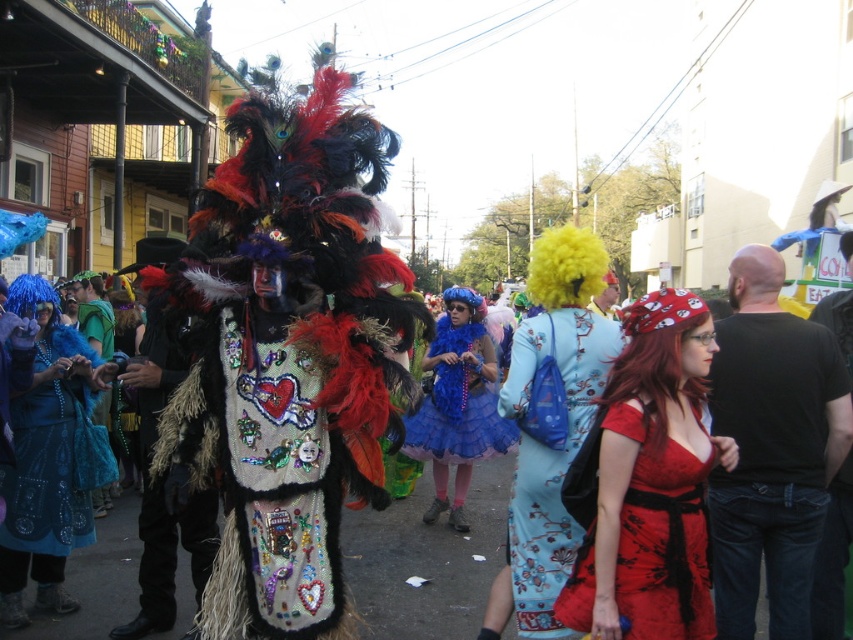
Question: Does black cotton shirt at right lie in front of shiny blue tulle skirt at center?

Choices:
 (A) no
 (B) yes

Answer: (B)

Question: Does floral silk dress at center have a larger size compared to shiny blue fabric at left?

Choices:
 (A) no
 (B) yes

Answer: (B)

Question: Which of the following is the farthest from the observer?

Choices:
 (A) shiny blue fabric at left
 (B) shiny blue fabric dress at left

Answer: (A)

Question: Which point is farther to the camera?

Choices:
 (A) (450, 316)
 (B) (526, 476)
 (C) (775, 560)

Answer: (A)

Question: Estimate the real-world distances between objects in this image. Which object is farther from the fuzzy black fur coat at center?

Choices:
 (A) shiny blue fabric at left
 (B) yellow fuzzy wig at upper right

Answer: (A)

Question: Is shiny blue tulle skirt at center above yellow fuzzy wig at upper right?

Choices:
 (A) no
 (B) yes

Answer: (A)